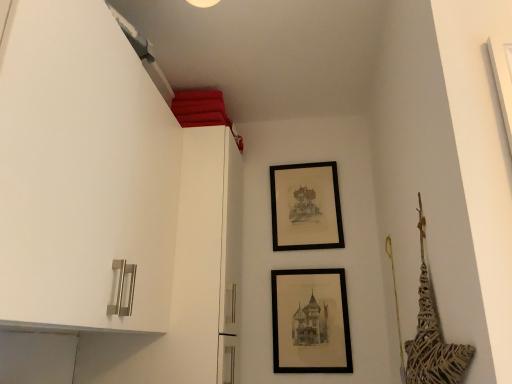
Where is `matte black picture frame at center, the 2th picture frame from the top`? The width and height of the screenshot is (512, 384). matte black picture frame at center, the 2th picture frame from the top is located at coordinates (310, 321).

Describe the element at coordinates (310, 321) in the screenshot. The image size is (512, 384). I see `matte black picture frame at center, the 1th picture frame from the front` at that location.

What is the approximate width of black matte picture frame at upper center, which is the second picture frame from front to back?

black matte picture frame at upper center, which is the second picture frame from front to back, is 2.30 inches in width.

The image size is (512, 384). What do you see at coordinates (306, 207) in the screenshot?
I see `black matte picture frame at upper center, which appears as the first picture frame when viewed from the back` at bounding box center [306, 207].

This screenshot has height=384, width=512. Find the location of `black matte picture frame at upper center, marked as the first picture frame in a top-to-bottom arrangement`. black matte picture frame at upper center, marked as the first picture frame in a top-to-bottom arrangement is located at coordinates (306, 207).

The width and height of the screenshot is (512, 384). In order to click on matte black picture frame at center, acting as the first picture frame starting from the bottom in this screenshot , I will do [310, 321].

Is matte black picture frame at center, which appears as the second picture frame when viewed from the back, to the left or to the right of black matte picture frame at upper center, which is the second picture frame from front to back, in the image?

Result: In the image, matte black picture frame at center, which appears as the second picture frame when viewed from the back, appears on the left side of black matte picture frame at upper center, which is the second picture frame from front to back.

Is matte black picture frame at center, the 1th picture frame from the front, in front of black matte picture frame at upper center, marked as the first picture frame in a top-to-bottom arrangement?

Yes, matte black picture frame at center, the 1th picture frame from the front, is closer to the camera.

Which point is more distant from viewer, (310, 328) or (310, 185)?

The point (310, 185) is more distant.

From the image's perspective, which one is positioned higher, matte black picture frame at center, acting as the first picture frame starting from the bottom, or black matte picture frame at upper center, the 2th picture frame ordered from the bottom?

From the image's view, black matte picture frame at upper center, the 2th picture frame ordered from the bottom, is above.

Based on the photo, from a real-world perspective, is matte black picture frame at center, the 1th picture frame from the front, positioned above or below black matte picture frame at upper center, marked as the first picture frame in a top-to-bottom arrangement?

Clearly, from a real-world perspective, matte black picture frame at center, the 1th picture frame from the front, is below black matte picture frame at upper center, marked as the first picture frame in a top-to-bottom arrangement.

Is matte black picture frame at center, the 1th picture frame from the front, thinner than black matte picture frame at upper center, which is the second picture frame from front to back?

Indeed, matte black picture frame at center, the 1th picture frame from the front, has a lesser width compared to black matte picture frame at upper center, which is the second picture frame from front to back.

Considering the sizes of objects matte black picture frame at center, acting as the first picture frame starting from the bottom, and black matte picture frame at upper center, which is the second picture frame from front to back, in the image provided, who is taller, matte black picture frame at center, acting as the first picture frame starting from the bottom, or black matte picture frame at upper center, which is the second picture frame from front to back,?

black matte picture frame at upper center, which is the second picture frame from front to back, is taller.

Considering the relative sizes of matte black picture frame at center, the 2th picture frame from the top, and black matte picture frame at upper center, the 2th picture frame ordered from the bottom, in the image provided, is matte black picture frame at center, the 2th picture frame from the top, bigger than black matte picture frame at upper center, the 2th picture frame ordered from the bottom,?

No, matte black picture frame at center, the 2th picture frame from the top, is not bigger than black matte picture frame at upper center, the 2th picture frame ordered from the bottom.

Consider the image. Is matte black picture frame at center, the 2th picture frame from the top, positioned beyond the bounds of black matte picture frame at upper center, which appears as the first picture frame when viewed from the back?

Absolutely, matte black picture frame at center, the 2th picture frame from the top, is external to black matte picture frame at upper center, which appears as the first picture frame when viewed from the back.

Is matte black picture frame at center, which appears as the second picture frame when viewed from the back, with black matte picture frame at upper center, which appears as the first picture frame when viewed from the back?

No, matte black picture frame at center, which appears as the second picture frame when viewed from the back, is not with black matte picture frame at upper center, which appears as the first picture frame when viewed from the back.

Is black matte picture frame at upper center, which appears as the first picture frame when viewed from the back, at the back of matte black picture frame at center, acting as the first picture frame starting from the bottom?

No, matte black picture frame at center, acting as the first picture frame starting from the bottom, is not facing away from black matte picture frame at upper center, which appears as the first picture frame when viewed from the back.

Could you measure the distance between matte black picture frame at center, which appears as the second picture frame when viewed from the back, and black matte picture frame at upper center, which is the second picture frame from front to back?

matte black picture frame at center, which appears as the second picture frame when viewed from the back, is 14.02 inches from black matte picture frame at upper center, which is the second picture frame from front to back.

This screenshot has height=384, width=512. Find the location of `picture frame in front of the black matte picture frame at upper center, which is the second picture frame from front to back`. picture frame in front of the black matte picture frame at upper center, which is the second picture frame from front to back is located at coordinates (310, 321).

Is black matte picture frame at upper center, marked as the first picture frame in a top-to-bottom arrangement, to the left or to the right of matte black picture frame at center, the 1th picture frame from the front, in the image?

black matte picture frame at upper center, marked as the first picture frame in a top-to-bottom arrangement, is to the right of matte black picture frame at center, the 1th picture frame from the front.

Does black matte picture frame at upper center, which is the second picture frame from front to back, lie behind matte black picture frame at center, the 2th picture frame from the top?

Yes, it is.

Does point (296, 185) appear closer or farther from the camera than point (291, 292)?

Point (296, 185) is positioned farther from the camera compared to point (291, 292).

From the image's perspective, between black matte picture frame at upper center, which appears as the first picture frame when viewed from the back, and matte black picture frame at center, the 1th picture frame from the front, which one is located above?

From the image's view, black matte picture frame at upper center, which appears as the first picture frame when viewed from the back, is above.

From a real-world perspective, who is located higher, black matte picture frame at upper center, marked as the first picture frame in a top-to-bottom arrangement, or matte black picture frame at center, the 1th picture frame from the front?

black matte picture frame at upper center, marked as the first picture frame in a top-to-bottom arrangement, is physically above.

Considering the sizes of objects black matte picture frame at upper center, which appears as the first picture frame when viewed from the back, and matte black picture frame at center, which appears as the second picture frame when viewed from the back, in the image provided, who is thinner, black matte picture frame at upper center, which appears as the first picture frame when viewed from the back, or matte black picture frame at center, which appears as the second picture frame when viewed from the back,?

matte black picture frame at center, which appears as the second picture frame when viewed from the back.

Who is taller, black matte picture frame at upper center, which is the second picture frame from front to back, or matte black picture frame at center, the 1th picture frame from the front?

black matte picture frame at upper center, which is the second picture frame from front to back, is taller.

Can you confirm if black matte picture frame at upper center, marked as the first picture frame in a top-to-bottom arrangement, is bigger than matte black picture frame at center, acting as the first picture frame starting from the bottom?

Yes, black matte picture frame at upper center, marked as the first picture frame in a top-to-bottom arrangement, is bigger than matte black picture frame at center, acting as the first picture frame starting from the bottom.

Is matte black picture frame at center, acting as the first picture frame starting from the bottom, inside black matte picture frame at upper center, the 2th picture frame ordered from the bottom?

No, matte black picture frame at center, acting as the first picture frame starting from the bottom, is located outside of black matte picture frame at upper center, the 2th picture frame ordered from the bottom.

Would you consider black matte picture frame at upper center, which is the second picture frame from front to back, to be distant from matte black picture frame at center, acting as the first picture frame starting from the bottom?

Actually, black matte picture frame at upper center, which is the second picture frame from front to back, and matte black picture frame at center, acting as the first picture frame starting from the bottom, are a little close together.

Is matte black picture frame at center, which appears as the second picture frame when viewed from the back, at the back of black matte picture frame at upper center, which is the second picture frame from front to back?

That's not correct — black matte picture frame at upper center, which is the second picture frame from front to back, is not looking away from matte black picture frame at center, which appears as the second picture frame when viewed from the back.

Measure the distance between black matte picture frame at upper center, the 2th picture frame ordered from the bottom, and matte black picture frame at center, which appears as the second picture frame when viewed from the back.

black matte picture frame at upper center, the 2th picture frame ordered from the bottom, is 35.61 centimeters from matte black picture frame at center, which appears as the second picture frame when viewed from the back.

Where is `picture frame that is in front of the black matte picture frame at upper center, the 2th picture frame ordered from the bottom`? The image size is (512, 384). picture frame that is in front of the black matte picture frame at upper center, the 2th picture frame ordered from the bottom is located at coordinates (310, 321).

At what (x,y) coordinates should I click in order to perform the action: click on picture frame on the right side of matte black picture frame at center, which appears as the second picture frame when viewed from the back. Please return your answer as a coordinate pair (x, y). This screenshot has width=512, height=384. Looking at the image, I should click on 306,207.

In order to click on picture frame in front of the black matte picture frame at upper center, which is the second picture frame from front to back in this screenshot , I will do `click(310, 321)`.